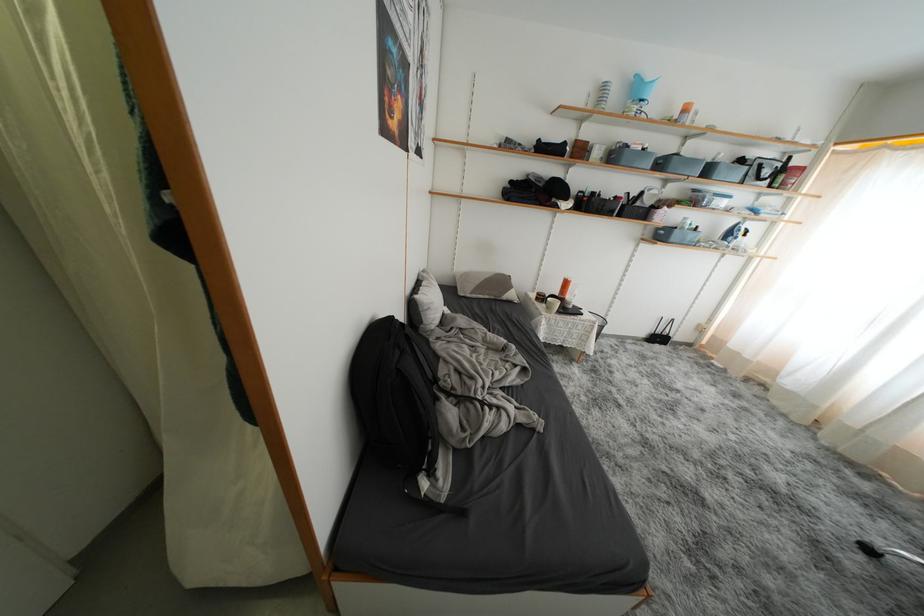
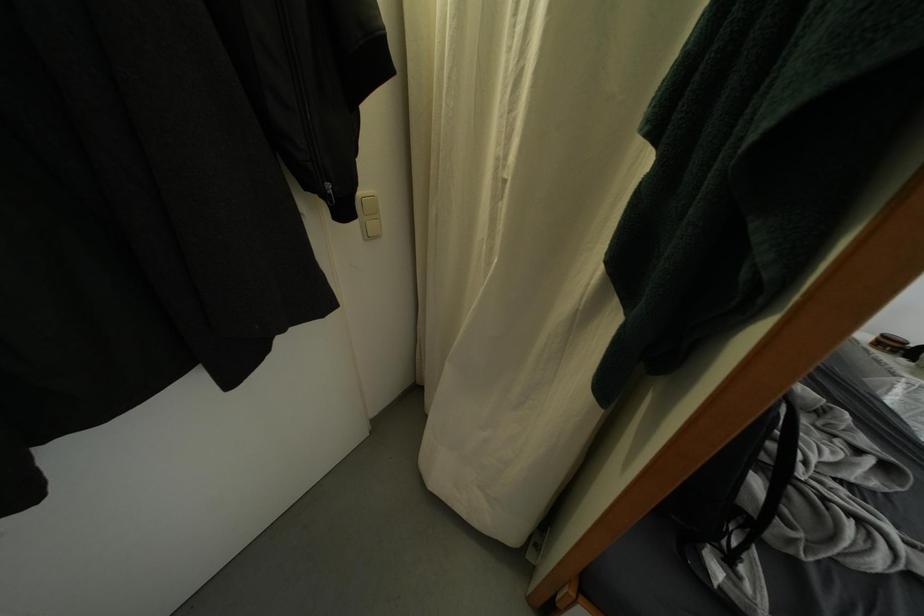
Where in the second image is the point corresponding to pixel 543 302 from the first image?

(884, 347)